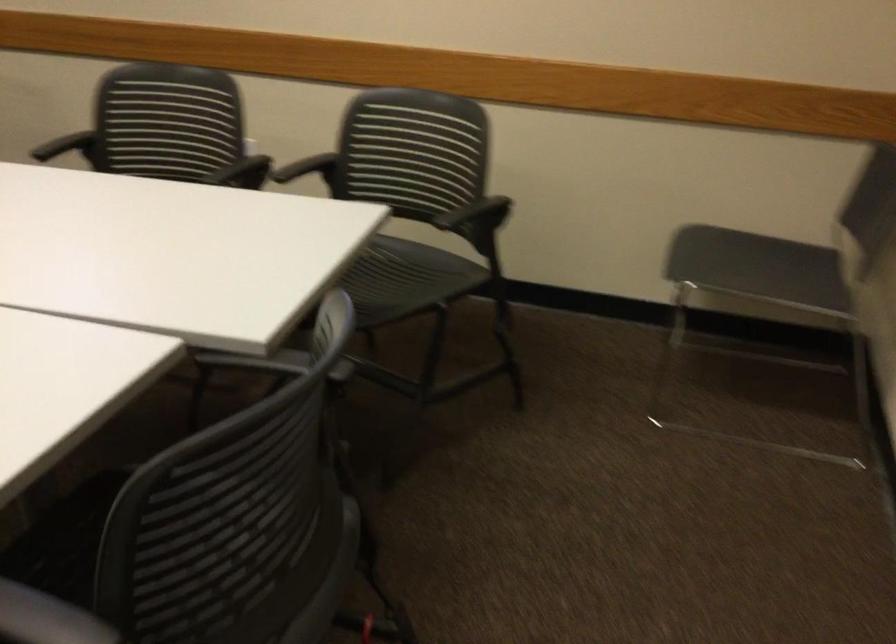
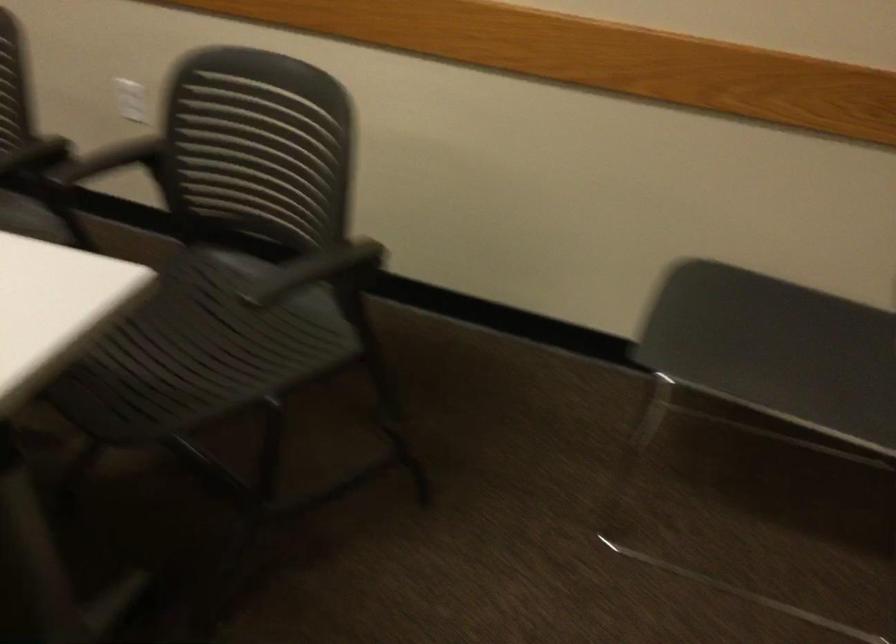
Find the pixel in the second image that matches (251,164) in the first image.

(35, 156)